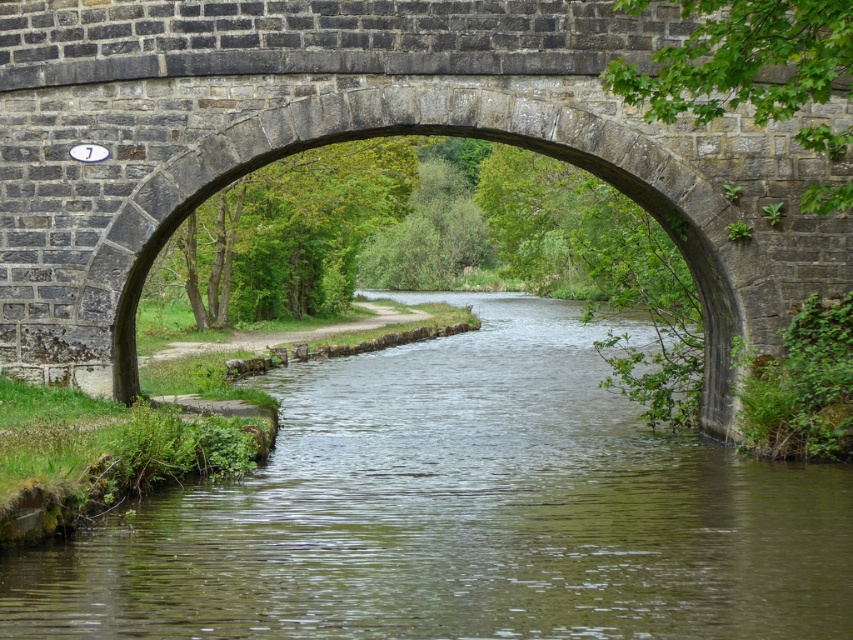
You are a boat captain navigating a small boat through the serene scene. The boat requires a passage wide enough to accommodate its 10 meters length. Can you determine if the green smooth water at center is wide enough for your boat to pass under the stone arch bridge at center?

The green smooth water at center has a larger size compared to the stone arch bridge at center, so the water is wider than the bridge. Since the boat is 10 meters long, it should be able to pass under the bridge as the water is wide enough to accommodate its length.

You are a boat operator who needs to navigate a 4.5 meter long boat under the stone arch bridge at center. The boat is currently on the green smooth water at center. Can you safely pass under the bridge without hitting it?

The distance between the green smooth water at center and the stone arch bridge at center is 5.44 meters. Since the boat is 4.5 meters long, it can safely pass under the bridge as the clearance is sufficient.